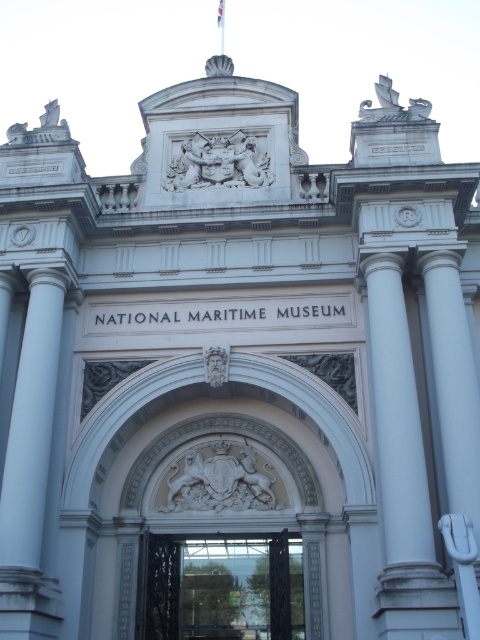
What do you see at coordinates (31, 467) in the screenshot? Image resolution: width=480 pixels, height=640 pixels. I see `white marble column at left` at bounding box center [31, 467].

Can you confirm if white marble column at left is positioned to the left of black wrought iron gate at center?

Yes, white marble column at left is to the left of black wrought iron gate at center.

Is point (26, 577) positioned in front of point (189, 628)?

That is True.

The width and height of the screenshot is (480, 640). Identify the location of white marble column at left. (31, 467).